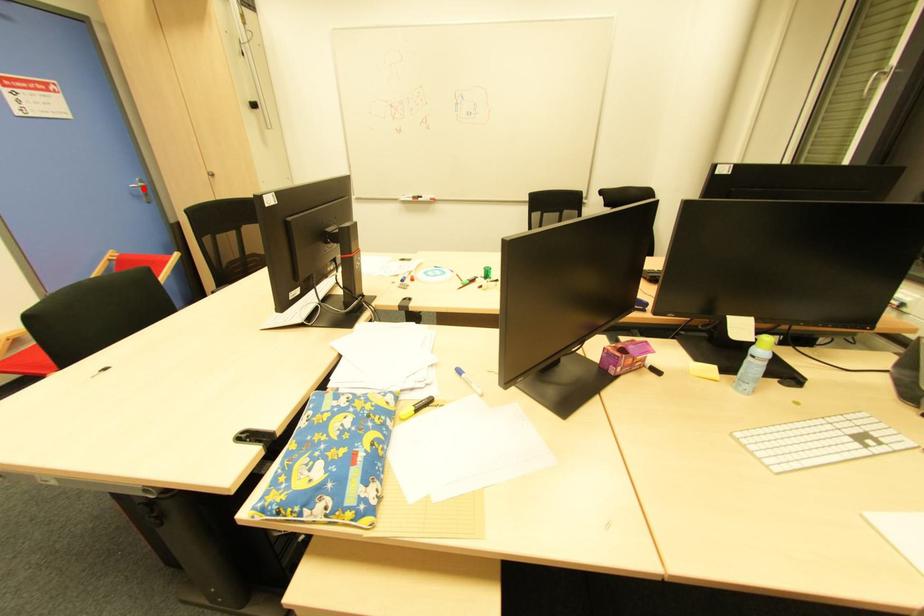
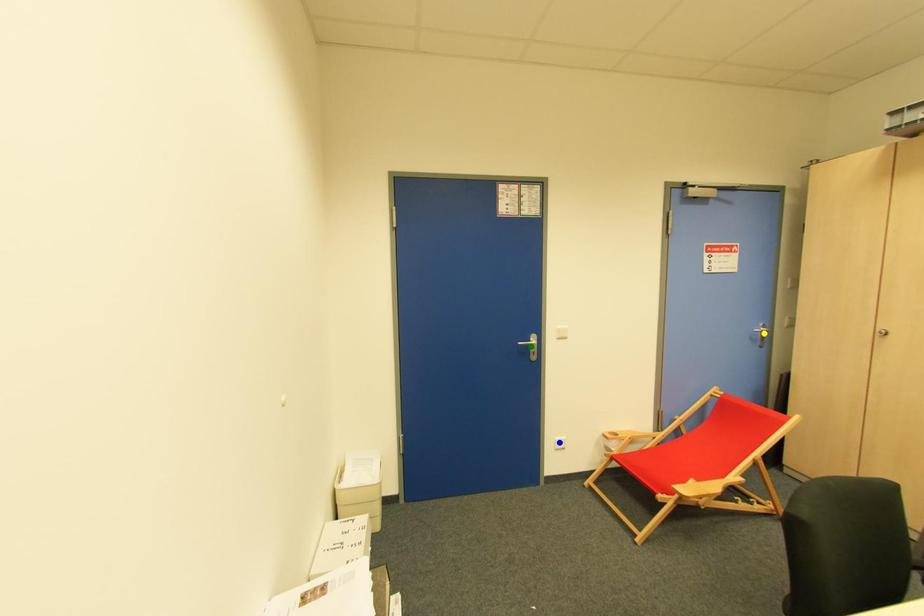
Question: I am providing you with two images of the same scene from different viewpoints. A red point is marked on the first image. You are given multiple points on the second image. Which point in image 2 is actually the same real-world point as the red point in image 1?

Choices:
 (A) blue point
 (B) yellow point
 (C) green point

Answer: (B)